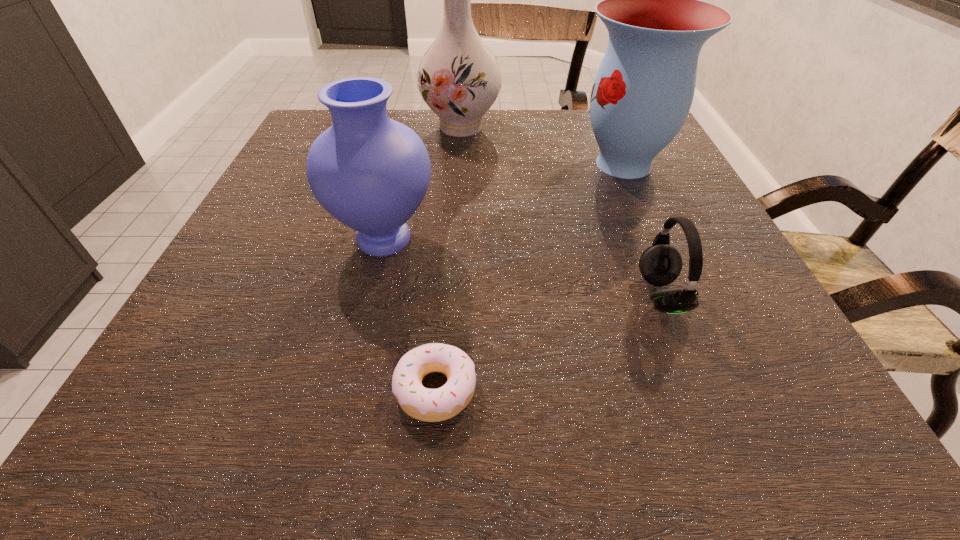
Locate an element on the screen. free space between the second shortest object and the rightmost vase is located at coordinates pos(642,230).

The width and height of the screenshot is (960, 540). Identify the location of empty space between the nearest object and the fourth tallest object. (548, 342).

In order to click on free space that is in between the headset and the shortest object in this screenshot , I will do `click(548, 342)`.

Image resolution: width=960 pixels, height=540 pixels. What are the coordinates of `unoccupied area between the rightmost vase and the shortest object` in the screenshot? It's located at (530, 276).

Where is `vacant region between the second shortest object and the rightmost vase`? This screenshot has height=540, width=960. vacant region between the second shortest object and the rightmost vase is located at coordinates (642, 230).

Image resolution: width=960 pixels, height=540 pixels. What are the coordinates of `free space between the fourth tallest object and the rightmost vase` in the screenshot? It's located at (642, 230).

Point out which object is positioned as the second nearest to the nearest vase. Please provide its 2D coordinates. Your answer should be formatted as a tuple, i.e. [(x, y)], where the tuple contains the x and y coordinates of a point satisfying the conditions above.

[(459, 78)]

I want to click on object that can be found as the second closest to the shortest object, so click(x=660, y=264).

Choose which vase is the second nearest neighbor to the nearest vase. Please provide its 2D coordinates. Your answer should be formatted as a tuple, i.e. [(x, y)], where the tuple contains the x and y coordinates of a point satisfying the conditions above.

[(642, 93)]

Locate which vase is the second closest to the rightmost vase. Please provide its 2D coordinates. Your answer should be formatted as a tuple, i.e. [(x, y)], where the tuple contains the x and y coordinates of a point satisfying the conditions above.

[(371, 173)]